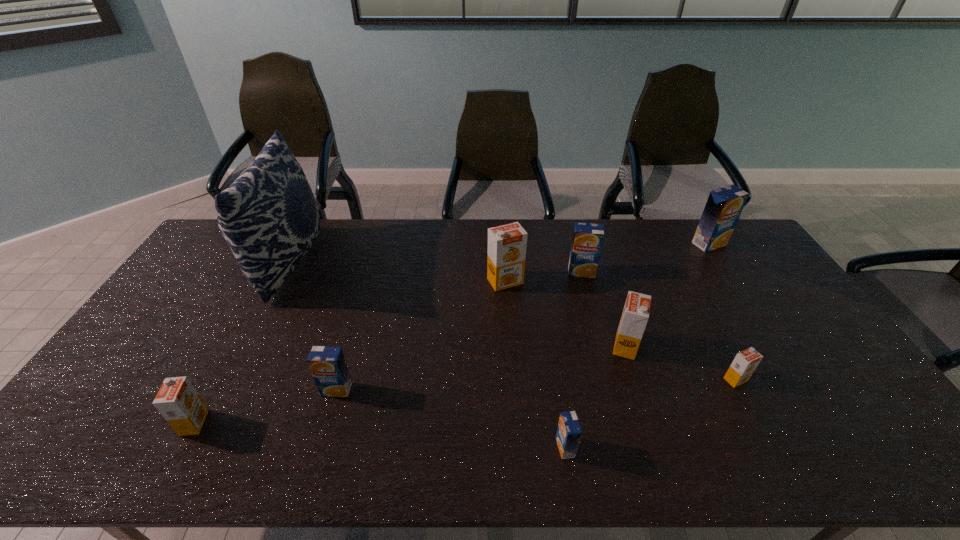
Identify the location of object present at the far right corner. (722, 210).

Find the location of `vacant space at the far edge of the desktop`. vacant space at the far edge of the desktop is located at coordinates (405, 249).

Locate an element on the screen. This screenshot has width=960, height=540. vacant space at the left edge is located at coordinates (112, 412).

Image resolution: width=960 pixels, height=540 pixels. I want to click on vacant space at the far left corner of the desktop, so [224, 238].

Find the location of a particular element. empty space that is in between the rightmost blue orange_juice and the third nearest orange orange juice is located at coordinates (667, 295).

This screenshot has width=960, height=540. I want to click on vacant area that lies between the cushion and the third smallest orange orange juice, so click(457, 305).

You are a GUI agent. You are given a task and a screenshot of the screen. Output one action in this format:
    pyautogui.click(x=<x>, y=<y>)
    Task: Click on the free spot between the fifth nearest object and the blue cushion
    This screenshot has width=960, height=540.
    Given the screenshot: What is the action you would take?
    pyautogui.click(x=457, y=305)

The width and height of the screenshot is (960, 540). I want to click on free space between the second farthest blue orange_juice and the nearest blue orange_juice, so click(x=573, y=360).

Where is `free space between the fifth nearest object and the third farthest orange orange juice`? The width and height of the screenshot is (960, 540). free space between the fifth nearest object and the third farthest orange orange juice is located at coordinates (681, 363).

What are the coordinates of `free space between the seventh object from right to left and the third blue orange_juice from left to right` in the screenshot? It's located at (459, 330).